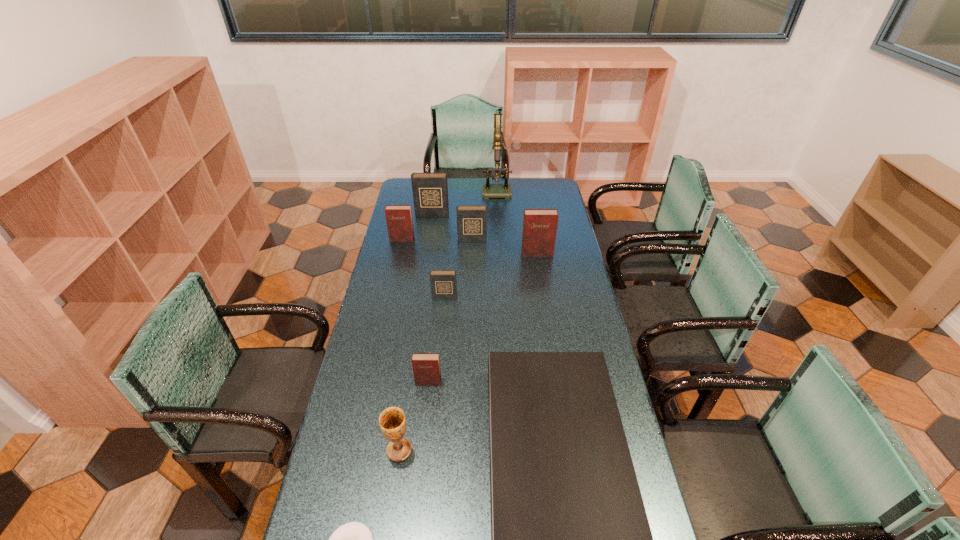
Where is `empty space between the smallest reddish-brown diary and the second farthest object`? Image resolution: width=960 pixels, height=540 pixels. empty space between the smallest reddish-brown diary and the second farthest object is located at coordinates (430, 299).

This screenshot has height=540, width=960. In order to click on free space between the second nearest dark diary and the rightmost reddish-brown diary in this screenshot , I will do `click(504, 247)`.

Where is `empty space that is in between the brown microscope and the chalice`? This screenshot has width=960, height=540. empty space that is in between the brown microscope and the chalice is located at coordinates (449, 320).

You are a GUI agent. You are given a task and a screenshot of the screen. Output one action in this format:
    pyautogui.click(x=<x>, y=<y>)
    Task: Click on the object that is the third closest to the second biggest dark diary
    
    Given the screenshot: What is the action you would take?
    pyautogui.click(x=399, y=220)

Identify which object is the third nearest to the biggest dark diary. Please provide its 2D coordinates. Your answer should be formatted as a tuple, i.e. [(x, y)], where the tuple contains the x and y coordinates of a point satisfying the conditions above.

[(489, 190)]

Select which diary appears as the third closest to the second nearest dark diary. Please provide its 2D coordinates. Your answer should be formatted as a tuple, i.e. [(x, y)], where the tuple contains the x and y coordinates of a point satisfying the conditions above.

[(399, 220)]

This screenshot has height=540, width=960. I want to click on diary that is the closest to the brown microscope, so click(x=430, y=190).

I want to click on dark diary that stands as the closest to the chalice, so click(443, 283).

Identify the location of dark diary identified as the second closest to the microscope. This screenshot has height=540, width=960. (471, 220).

Select which reddish-brown diary is the second closest to the second reddish-brown diary from left to right. Please provide its 2D coordinates. Your answer should be formatted as a tuple, i.e. [(x, y)], where the tuple contains the x and y coordinates of a point satisfying the conditions above.

[(399, 220)]